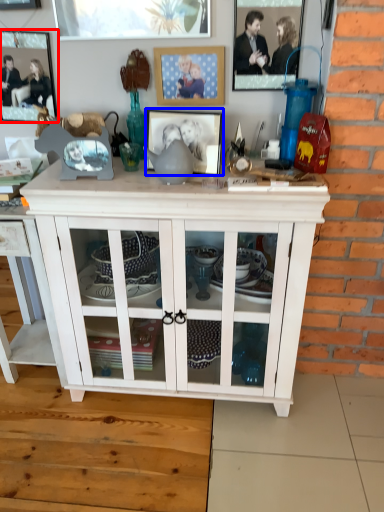
Question: Among these objects, which one is farthest to the camera, picture frame (highlighted by a red box) or picture frame (highlighted by a blue box)?

Choices:
 (A) picture frame
 (B) picture frame

Answer: (A)